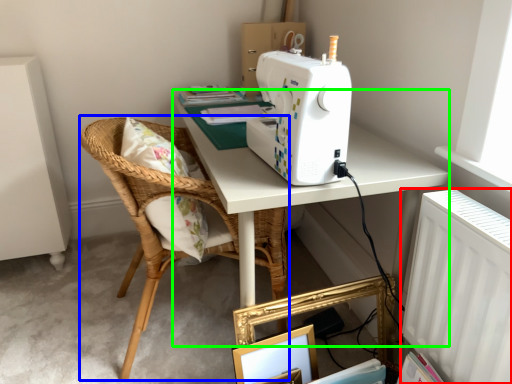
Question: Which object is positioned farthest from radiator (highlighted by a red box)? Select from chair (highlighted by a blue box) and table (highlighted by a green box).

Choices:
 (A) chair
 (B) table

Answer: (A)